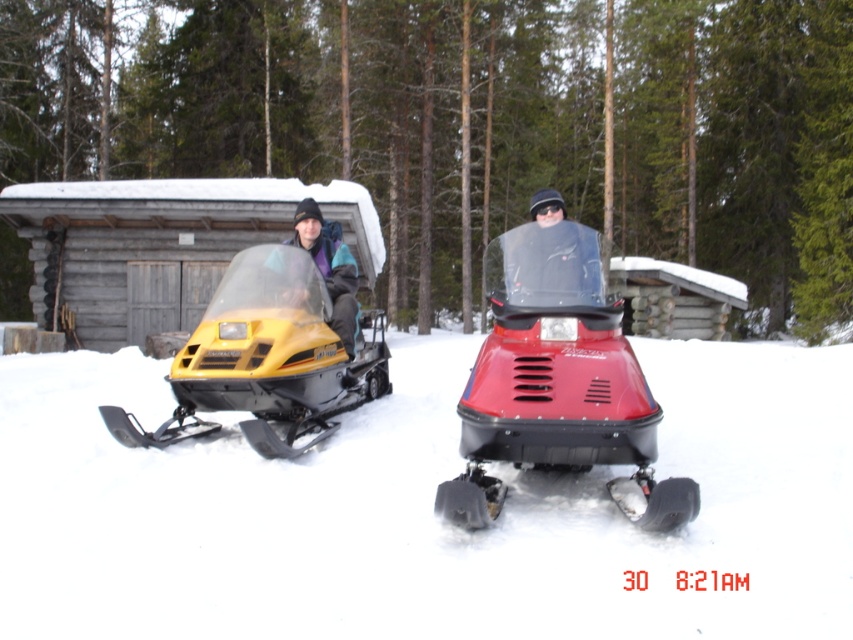
Is yellow matte snowmobile at left taller than matte black jacket at center?

Indeed, yellow matte snowmobile at left has a greater height compared to matte black jacket at center.

Does yellow matte snowmobile at left appear under matte black jacket at center?

Yes, yellow matte snowmobile at left is below matte black jacket at center.

Where is `yellow matte snowmobile at left`? Image resolution: width=853 pixels, height=640 pixels. yellow matte snowmobile at left is located at coordinates (265, 358).

Is shiny red plastic snowmobile at center closer to camera compared to matte yellow snowmobile at left?

That is True.

Describe the element at coordinates (556, 381) in the screenshot. I see `shiny red plastic snowmobile at center` at that location.

Find the location of a particular element. shiny red plastic snowmobile at center is located at coordinates (556, 381).

Is yellow plastic snowmobile at left to the left of matte black jacket at center from the viewer's perspective?

No, yellow plastic snowmobile at left is not to the left of matte black jacket at center.

Can you confirm if yellow plastic snowmobile at left is shorter than matte black jacket at center?

Incorrect, yellow plastic snowmobile at left's height does not fall short of matte black jacket at center's.

This screenshot has height=640, width=853. What do you see at coordinates (422, 509) in the screenshot?
I see `yellow plastic snowmobile at left` at bounding box center [422, 509].

The image size is (853, 640). I want to click on yellow plastic snowmobile at left, so click(422, 509).